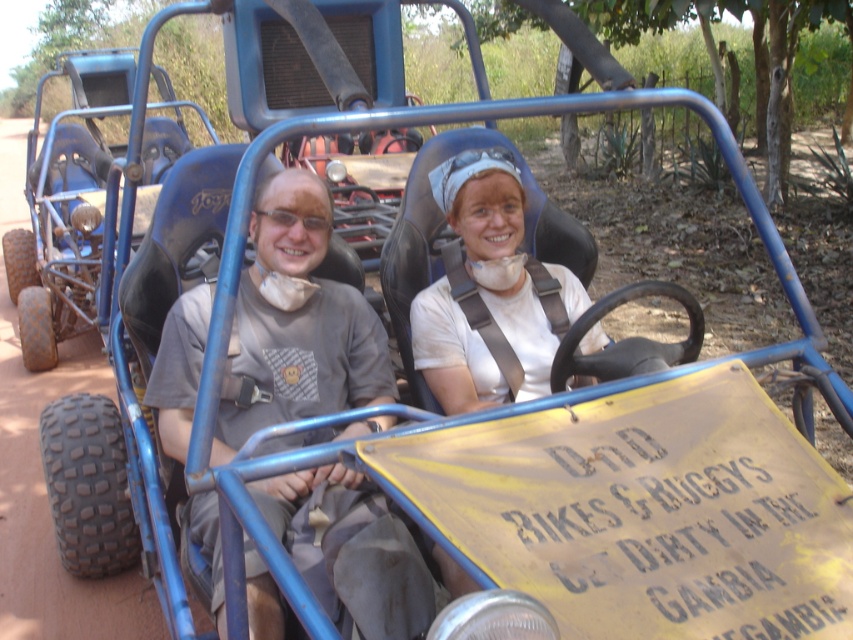
Question: Which object appears closest to the camera in this image?

Choices:
 (A) white matte shirt at center
 (B) matte gray t-shirt at center
 (C) blue matte go-kart at left

Answer: (B)

Question: In this image, where is matte gray t-shirt at center located relative to white matte shirt at center?

Choices:
 (A) left
 (B) right

Answer: (A)

Question: Can you confirm if matte gray t-shirt at center is wider than white matte shirt at center?

Choices:
 (A) no
 (B) yes

Answer: (B)

Question: Which of the following is the farthest from the observer?

Choices:
 (A) blue matte go-kart at left
 (B) matte gray t-shirt at center

Answer: (A)

Question: Which point is farther to the camera?

Choices:
 (A) (508, 396)
 (B) (373, 342)
 (C) (103, 88)

Answer: (C)

Question: Can you confirm if matte gray t-shirt at center is thinner than blue matte go-kart at left?

Choices:
 (A) no
 (B) yes

Answer: (A)